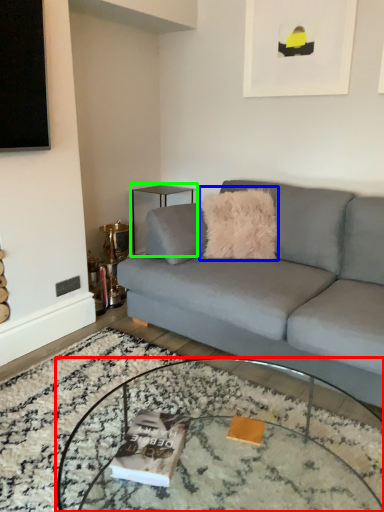
Question: Based on their relative distances, which object is farther from coffee table (highlighted by a red box)? Choose from throw pillow (highlighted by a blue box) and side table (highlighted by a green box).

Choices:
 (A) throw pillow
 (B) side table

Answer: (B)